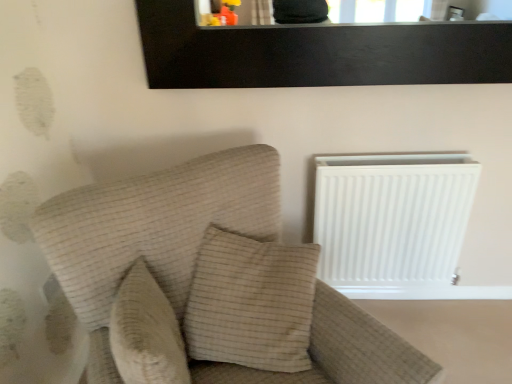
Where is `black wood picture frame at upper center`? Image resolution: width=512 pixels, height=384 pixels. black wood picture frame at upper center is located at coordinates (310, 54).

Measure the distance between point (x=225, y=280) and camera.

1.28 meters.

Describe the element at coordinates (146, 332) in the screenshot. The height and width of the screenshot is (384, 512). I see `beige textured pillow at center, positioned as the second pillow in right-to-left order` at that location.

Where is `beige textured pillow at center, positioned as the second pillow in right-to-left order`? The height and width of the screenshot is (384, 512). beige textured pillow at center, positioned as the second pillow in right-to-left order is located at coordinates (146, 332).

Identify the location of white matte radiator at right. The width and height of the screenshot is (512, 384). (394, 223).

This screenshot has height=384, width=512. I want to click on black wood picture frame at upper center, so click(310, 54).

In the scene shown: Is white matte radiator at right oriented away from beige textured pillow at center, which is the first pillow in right-to-left order?

white matte radiator at right is not turned away from beige textured pillow at center, which is the first pillow in right-to-left order.

How far apart are white matte radiator at right and beige textured pillow at center, which is counted as the second pillow, starting from the left?

white matte radiator at right and beige textured pillow at center, which is counted as the second pillow, starting from the left, are 21.97 inches apart.

From a real-world perspective, is white matte radiator at right over beige textured pillow at center, which is the first pillow in right-to-left order?

No.

Could beige textured pillow at center, which is the first pillow in right-to-left order, be considered to be inside white matte radiator at right?

Definitely not — beige textured pillow at center, which is the first pillow in right-to-left order, is not inside white matte radiator at right.

Is beige textured pillow at center, positioned as the 1th pillow in left-to-right order, to the left of beige textured pillow at center, which is the first pillow in right-to-left order, from the viewer's perspective?

Yes, beige textured pillow at center, positioned as the 1th pillow in left-to-right order, is to the left of beige textured pillow at center, which is the first pillow in right-to-left order.

What's the angular difference between beige textured pillow at center, positioned as the second pillow in right-to-left order, and beige textured pillow at center, which is the first pillow in right-to-left order,'s facing directions?

112 degrees separate the facing orientations of beige textured pillow at center, positioned as the second pillow in right-to-left order, and beige textured pillow at center, which is the first pillow in right-to-left order.

Image resolution: width=512 pixels, height=384 pixels. In order to click on pillow that is above the beige textured pillow at center, positioned as the 1th pillow in left-to-right order (from the image's perspective) in this screenshot , I will do `click(251, 302)`.

Who is bigger, beige textured pillow at center, positioned as the second pillow in right-to-left order, or beige fabric couch at left?

Bigger between the two is beige fabric couch at left.

Which is more to the right, beige textured pillow at center, positioned as the second pillow in right-to-left order, or beige fabric couch at left?

beige fabric couch at left is more to the right.

Based on the photo, measure the distance from beige textured pillow at center, positioned as the 1th pillow in left-to-right order, to beige fabric couch at left.

6.84 inches.

Considering the sizes of beige textured pillow at center, positioned as the second pillow in right-to-left order, and beige fabric couch at left in the image, is beige textured pillow at center, positioned as the second pillow in right-to-left order, taller or shorter than beige fabric couch at left?

In the image, beige textured pillow at center, positioned as the second pillow in right-to-left order, appears to be shorter than beige fabric couch at left.

Is beige textured pillow at center, which is the first pillow in right-to-left order, smaller than white matte radiator at right?

Correct, beige textured pillow at center, which is the first pillow in right-to-left order, occupies less space than white matte radiator at right.

Between beige textured pillow at center, which is counted as the second pillow, starting from the left, and white matte radiator at right, which one has smaller width?

Thinner between the two is white matte radiator at right.

Is beige fabric couch at left situated inside beige textured pillow at center, positioned as the second pillow in right-to-left order, or outside?

beige fabric couch at left is located beyond the bounds of beige textured pillow at center, positioned as the second pillow in right-to-left order.

Identify the location of furniture on the right of the beige textured pillow at center, positioned as the second pillow in right-to-left order. The height and width of the screenshot is (384, 512). (152, 231).

Which of these two, beige fabric couch at left or beige textured pillow at center, positioned as the 1th pillow in left-to-right order, stands shorter?

beige textured pillow at center, positioned as the 1th pillow in left-to-right order, is shorter.

From a real-world perspective, is beige fabric couch at left located higher than beige textured pillow at center, which is counted as the second pillow, starting from the left?

Actually, beige fabric couch at left is physically below beige textured pillow at center, which is counted as the second pillow, starting from the left, in the real world.

Can you confirm if beige fabric couch at left is bigger than beige textured pillow at center, which is counted as the second pillow, starting from the left?

Correct, beige fabric couch at left is larger in size than beige textured pillow at center, which is counted as the second pillow, starting from the left.

Which object is positioned more to the left, beige fabric couch at left or beige textured pillow at center, which is the first pillow in right-to-left order?

beige fabric couch at left is more to the left.

The height and width of the screenshot is (384, 512). What are the coordinates of `pillow to the right of beige fabric couch at left` in the screenshot? It's located at (251, 302).

Between point (234, 347) and point (458, 54), which one is positioned behind?

The point (458, 54) is farther from the camera.

In the scene shown: Can you confirm if beige textured pillow at center, which is the first pillow in right-to-left order, is wider than black wood picture frame at upper center?

Correct, the width of beige textured pillow at center, which is the first pillow in right-to-left order, exceeds that of black wood picture frame at upper center.

From the image's perspective, which is below, beige textured pillow at center, which is the first pillow in right-to-left order, or black wood picture frame at upper center?

From the image's view, beige textured pillow at center, which is the first pillow in right-to-left order, is below.

From a real-world perspective, who is located lower, beige textured pillow at center, which is the first pillow in right-to-left order, or black wood picture frame at upper center?

In real-world perspective, beige textured pillow at center, which is the first pillow in right-to-left order, is lower.

Find the location of a particular element. radiator on the right of beige textured pillow at center, which is counted as the second pillow, starting from the left is located at coordinates (394, 223).

Locate an element on the screen. The image size is (512, 384). pillow in front of the beige textured pillow at center, which is the first pillow in right-to-left order is located at coordinates (146, 332).

Based on their spatial positions, is black wood picture frame at upper center or beige textured pillow at center, which is the first pillow in right-to-left order, further from beige textured pillow at center, positioned as the 1th pillow in left-to-right order?

The object further to beige textured pillow at center, positioned as the 1th pillow in left-to-right order, is black wood picture frame at upper center.

Estimate the real-world distances between objects in this image. Which object is closer to black wood picture frame at upper center, beige textured pillow at center, positioned as the 1th pillow in left-to-right order, or beige fabric couch at left?

→ The object closer to black wood picture frame at upper center is beige fabric couch at left.

In the scene shown: Based on their spatial positions, is black wood picture frame at upper center or beige textured pillow at center, positioned as the second pillow in right-to-left order, closer to white matte radiator at right?

Among the two, black wood picture frame at upper center is located nearer to white matte radiator at right.

Based on their spatial positions, is beige textured pillow at center, positioned as the 1th pillow in left-to-right order, or black wood picture frame at upper center further from beige fabric couch at left?

Based on the image, black wood picture frame at upper center appears to be further to beige fabric couch at left.

From the image, which object appears to be farther from beige fabric couch at left, black wood picture frame at upper center or beige textured pillow at center, positioned as the second pillow in right-to-left order?

Among the two, black wood picture frame at upper center is located further to beige fabric couch at left.

Which object lies nearer to the anchor point white matte radiator at right, beige textured pillow at center, positioned as the 1th pillow in left-to-right order, or beige fabric couch at left?

The object closer to white matte radiator at right is beige fabric couch at left.

Estimate the real-world distances between objects in this image. Which object is further from beige fabric couch at left, white matte radiator at right or beige textured pillow at center, positioned as the second pillow in right-to-left order?

Among the two, white matte radiator at right is located further to beige fabric couch at left.

Considering their positions, is beige textured pillow at center, which is counted as the second pillow, starting from the left, positioned closer to beige fabric couch at left than black wood picture frame at upper center?

→ Based on the image, beige textured pillow at center, which is counted as the second pillow, starting from the left, appears to be nearer to beige fabric couch at left.

You are a GUI agent. You are given a task and a screenshot of the screen. Output one action in this format:
    pyautogui.click(x=<x>, y=<y>)
    Task: Click on the pillow between black wood picture frame at upper center and beige textured pillow at center, positioned as the second pillow in right-to-left order, in the up-down direction
    The width and height of the screenshot is (512, 384).
    Given the screenshot: What is the action you would take?
    pyautogui.click(x=251, y=302)

In order to click on pillow situated between beige textured pillow at center, positioned as the 1th pillow in left-to-right order, and white matte radiator at right from left to right in this screenshot , I will do `click(251, 302)`.

This screenshot has height=384, width=512. In order to click on picture frame between beige fabric couch at left and white matte radiator at right from front to back in this screenshot , I will do `click(310, 54)`.

At what (x,y) coordinates should I click in order to perform the action: click on pillow located between beige fabric couch at left and beige textured pillow at center, which is counted as the second pillow, starting from the left, in the depth direction. Please return your answer as a coordinate pair (x, y). Looking at the image, I should click on (146, 332).